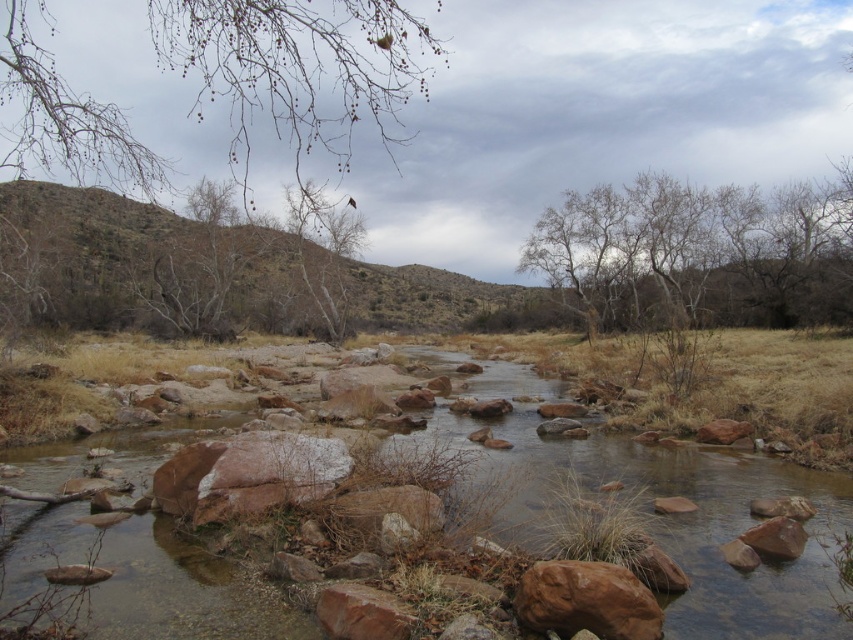
Question: Which is nearer to the bare branches at upper right?

Choices:
 (A) reddish-brown rock at lower center
 (B) bare branches at upper left
 (C) brown rock stream at center

Answer: (C)

Question: Does bare branches at upper right have a larger size compared to brown rough rock at lower right?

Choices:
 (A) no
 (B) yes

Answer: (B)

Question: Is brown rock stream at center in front of bare branches at upper right?

Choices:
 (A) yes
 (B) no

Answer: (A)

Question: Which of the following is the closest to the observer?

Choices:
 (A) brown rock stream at center
 (B) bare branches at upper right
 (C) reddish-brown rock at lower center
 (D) bare branches at upper left

Answer: (C)

Question: Which point is farther from the camera taking this photo?

Choices:
 (A) (442, 458)
 (B) (345, 608)
 (C) (225, 4)

Answer: (C)

Question: Does brown rock stream at center have a smaller size compared to brown rough rock at lower right?

Choices:
 (A) yes
 (B) no

Answer: (B)